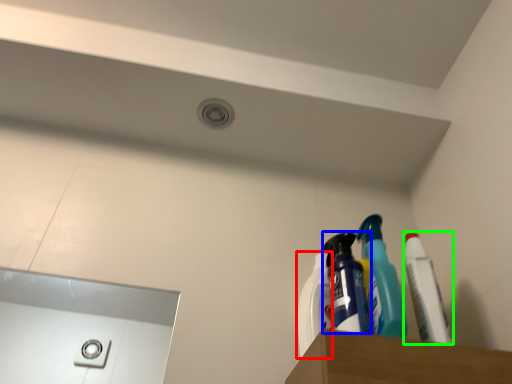
Question: Which is farther away from cleaning product (highlighted by a red box)? cleaning product (highlighted by a blue box) or toothpaste (highlighted by a green box)?

Choices:
 (A) cleaning product
 (B) toothpaste

Answer: (B)